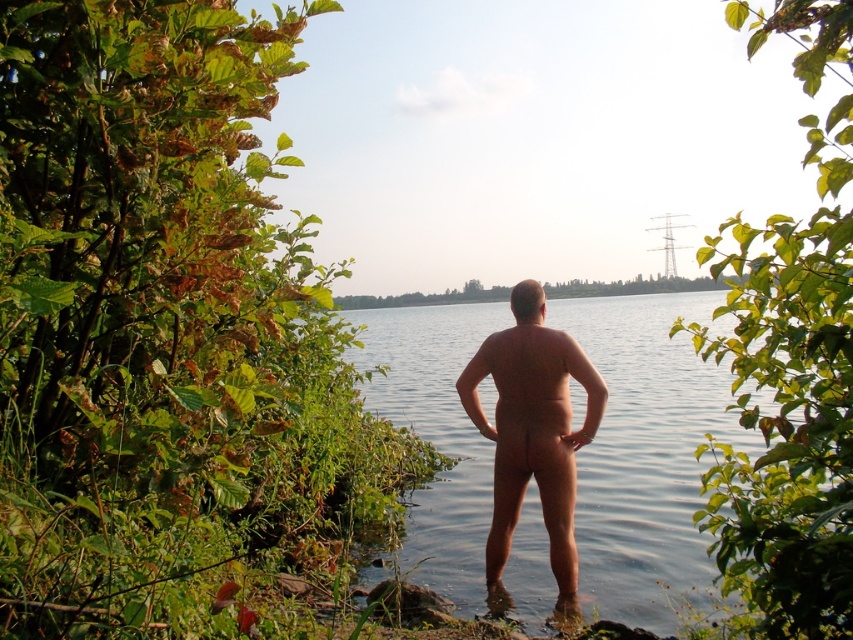
You are a photographer wanting to capture the skinny naked man at center without including the green leafy shrubs at left in the frame. Based on their positions, is this possible?

Yes, since the green leafy shrubs at left are to the left of the skinny naked man at center, you can position yourself to the right side of the man to exclude the shrubs from the frame.